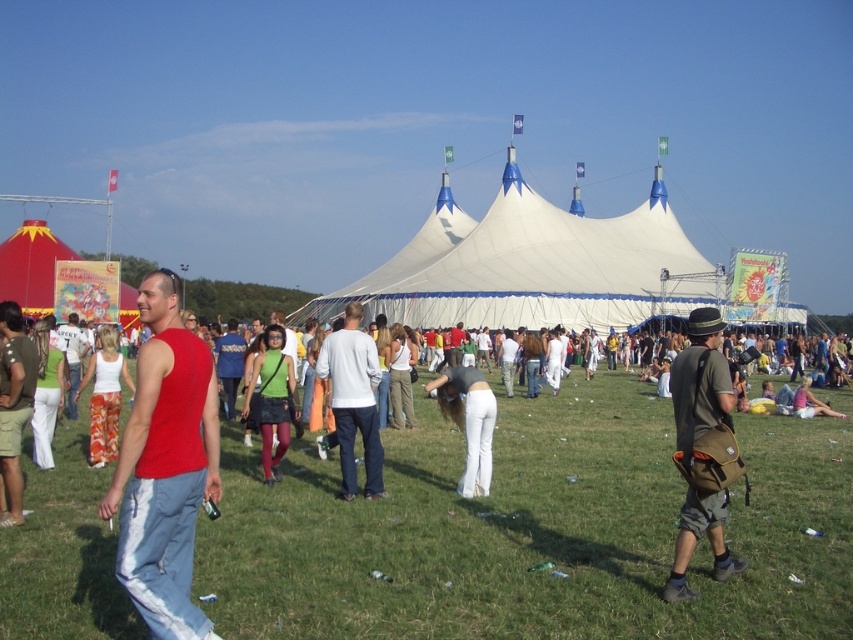
Question: Is matte red tank top at center bigger than matte red tank top at left?

Choices:
 (A) yes
 (B) no

Answer: (A)

Question: Based on their relative distances, which object is farther from the white fabric tent at center?

Choices:
 (A) white matte pants at center
 (B) red fabric tent at left
 (C) green matte tank top at center

Answer: (B)

Question: Among these points, which one is nearest to the camera?

Choices:
 (A) (329, 339)
 (B) (51, 272)
 (C) (257, 406)

Answer: (A)

Question: Is green grass at center positioned at the back of white matte pants at center?

Choices:
 (A) no
 (B) yes

Answer: (A)

Question: Among these points, which one is nearest to the camera?

Choices:
 (A) (793, 595)
 (B) (482, 422)
 (C) (140, 435)
 (D) (132, 310)

Answer: (C)

Question: Is white fabric tent at center in front of green matte tank top at center?

Choices:
 (A) no
 (B) yes

Answer: (A)